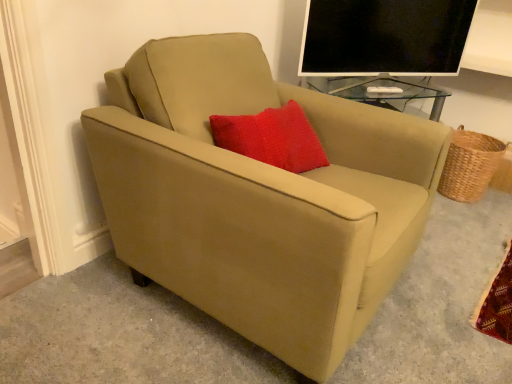
Question: Is suede beige armchair at center in front of or behind woven brown basket at right in the image?

Choices:
 (A) front
 (B) behind

Answer: (A)

Question: From a real-world perspective, is suede beige armchair at center physically located above or below woven brown basket at right?

Choices:
 (A) above
 (B) below

Answer: (A)

Question: Estimate the real-world distances between objects in this image. Which object is farther from the black glossy monitor at upper right?

Choices:
 (A) suede beige armchair at center
 (B) woven brown basket at right

Answer: (A)

Question: Estimate the real-world distances between objects in this image. Which object is farther from the black glossy monitor at upper right?

Choices:
 (A) suede beige armchair at center
 (B) woven brown basket at right

Answer: (A)